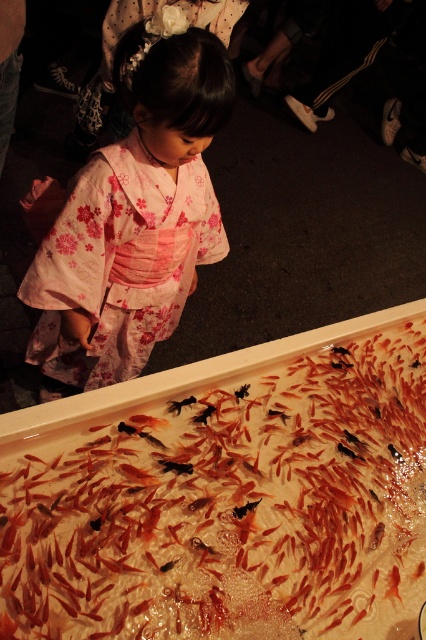
Which of these two, pink floral kimono at center or black glossy fish at center, stands shorter?

black glossy fish at center

Does pink floral kimono at center come behind black glossy fish at center?

No, pink floral kimono at center is in front of black glossy fish at center.

Is point (118, 275) closer to camera compared to point (172, 403)?

No, it is not.

You are a GUI agent. You are given a task and a screenshot of the screen. Output one action in this format:
    pyautogui.click(x=<x>, y=<y>)
    Task: Click on the pink floral kimono at center
    The image size is (426, 640).
    Given the screenshot: What is the action you would take?
    pyautogui.click(x=120, y=260)

Does translucent plastic tray at lower center have a smaller size compared to pink floral kimono at center?

No, translucent plastic tray at lower center is not smaller than pink floral kimono at center.

Between translucent plastic tray at lower center and pink floral kimono at center, which one appears on the right side from the viewer's perspective?

From the viewer's perspective, translucent plastic tray at lower center appears more on the right side.

Describe the element at coordinates (227, 496) in the screenshot. The width and height of the screenshot is (426, 640). I see `translucent plastic tray at lower center` at that location.

You are a GUI agent. You are given a task and a screenshot of the screen. Output one action in this format:
    pyautogui.click(x=<x>, y=<y>)
    Task: Click on the translucent plastic tray at lower center
    The height and width of the screenshot is (640, 426).
    Given the screenshot: What is the action you would take?
    pyautogui.click(x=227, y=496)

What do you see at coordinates (227, 496) in the screenshot? I see `translucent plastic tray at lower center` at bounding box center [227, 496].

How far apart are translucent plastic tray at lower center and black glossy fish at center?

The distance of translucent plastic tray at lower center from black glossy fish at center is 13.15 inches.

Is point (356, 451) behind point (172, 401)?

Yes.

The image size is (426, 640). In order to click on translucent plastic tray at lower center in this screenshot , I will do pyautogui.click(x=227, y=496).